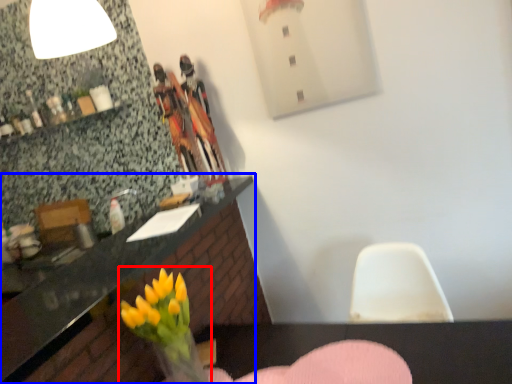
Question: Which object appears closest to the camera in this image, floral arrangement (highlighted by a red box) or countertop (highlighted by a blue box)?

Choices:
 (A) floral arrangement
 (B) countertop

Answer: (B)